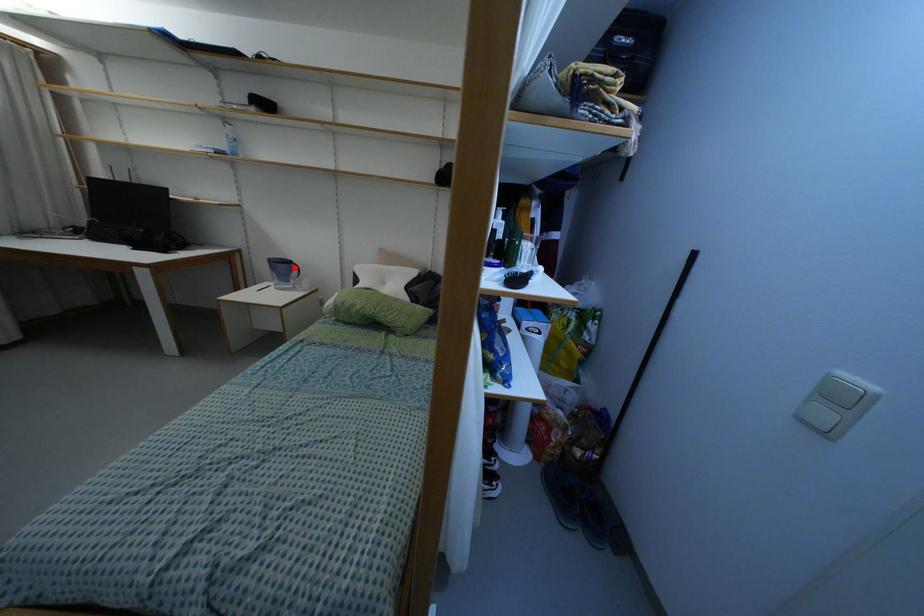
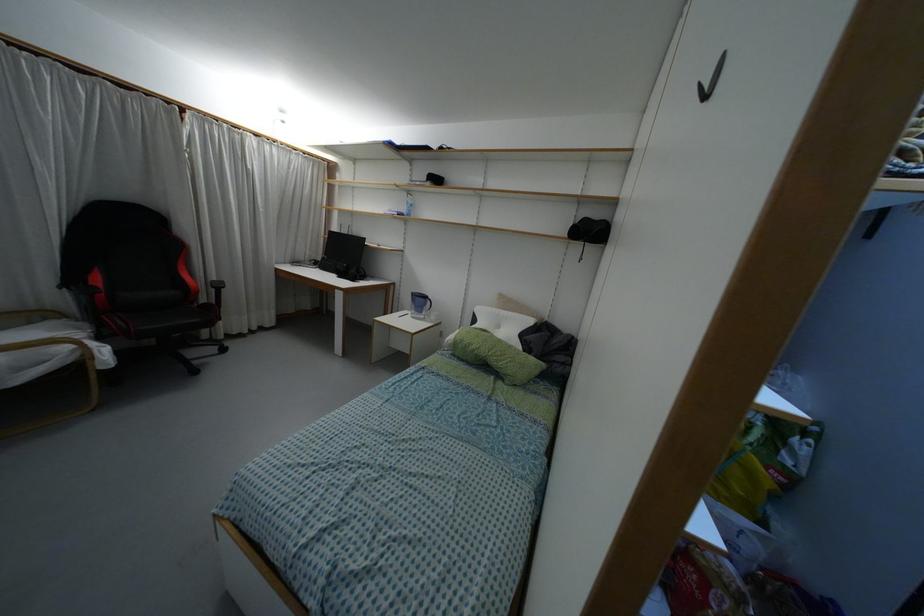
In the second image, find the point that corresponds to the highlighted location in the first image.

(428, 302)